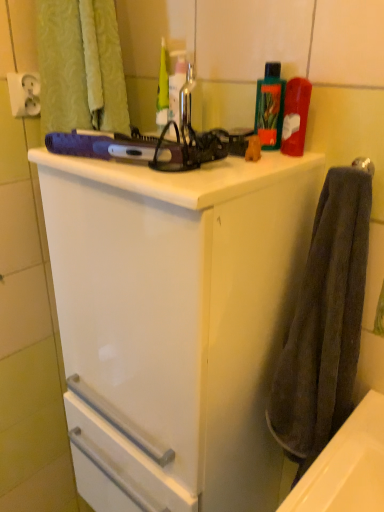
Question: Does metallic silver faucet at upper center have a greater width compared to dark gray towel at right?

Choices:
 (A) no
 (B) yes

Answer: (A)

Question: Is metallic silver faucet at upper center facing away from dark gray towel at right?

Choices:
 (A) yes
 (B) no

Answer: (B)

Question: Is the position of metallic silver faucet at upper center more distant than that of dark gray towel at right?

Choices:
 (A) no
 (B) yes

Answer: (B)

Question: Would you say metallic silver faucet at upper center is outside dark gray towel at right?

Choices:
 (A) no
 (B) yes

Answer: (B)

Question: Does metallic silver faucet at upper center have a lesser width compared to dark gray towel at right?

Choices:
 (A) no
 (B) yes

Answer: (B)

Question: Are metallic silver faucet at upper center and dark gray towel at right located far from each other?

Choices:
 (A) no
 (B) yes

Answer: (A)

Question: From the image's perspective, is white glossy cabinet at upper center located above dark gray towel at right?

Choices:
 (A) no
 (B) yes

Answer: (A)

Question: Considering the relative sizes of white glossy cabinet at upper center and dark gray towel at right in the image provided, is white glossy cabinet at upper center shorter than dark gray towel at right?

Choices:
 (A) yes
 (B) no

Answer: (B)

Question: Does white glossy cabinet at upper center lie in front of dark gray towel at right?

Choices:
 (A) no
 (B) yes

Answer: (B)

Question: Is dark gray towel at right located within white glossy cabinet at upper center?

Choices:
 (A) no
 (B) yes

Answer: (A)

Question: Can you confirm if white glossy cabinet at upper center is taller than dark gray towel at right?

Choices:
 (A) no
 (B) yes

Answer: (B)

Question: Can you confirm if white glossy cabinet at upper center is thinner than dark gray towel at right?

Choices:
 (A) no
 (B) yes

Answer: (A)

Question: Is green plastic bottle at upper right positioned with its back to translucent plastic bottle at upper center?

Choices:
 (A) yes
 (B) no

Answer: (B)